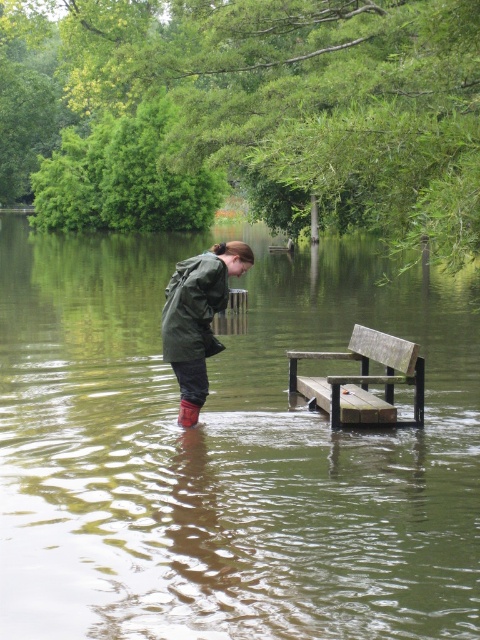
You are a lifeguard in the flooded area. You need to place a floating rescue buoy between the wooden bench at lower center and the brown rubber rain boot at lower center. Which object should you place the buoy closer to so that it is equidistant from both objects?

The wooden bench at lower center is larger in size than the brown rubber rain boot at lower center. To place the buoy equidistant from both, it should be closer to the smaller object, the brown rubber rain boot at lower center, since the bench is larger and would require more space between them to maintain equal distance.